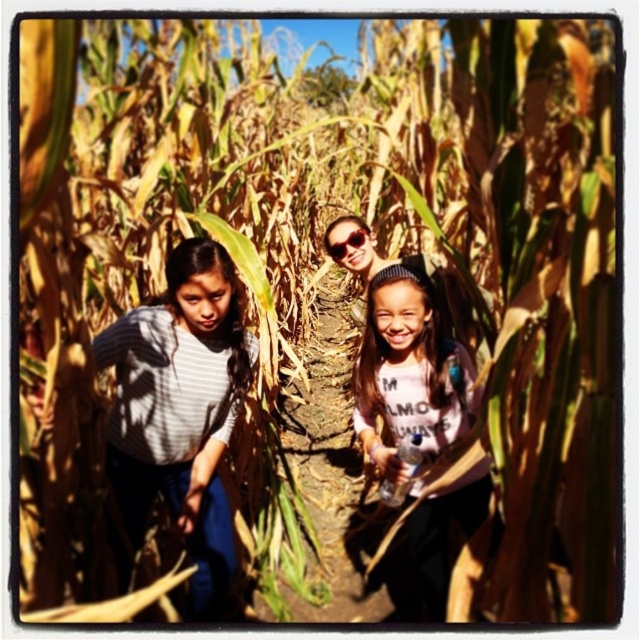
Who is positioned more to the left, white cotton shirt at center or sunglasses at center?

From the viewer's perspective, sunglasses at center appears more on the left side.

Which is in front, point (410, 394) or point (336, 244)?

Positioned in front is point (410, 394).

What do you see at coordinates (410, 372) in the screenshot? I see `white cotton shirt at center` at bounding box center [410, 372].

In order to click on white cotton shirt at center in this screenshot , I will do `click(410, 372)`.

Which is above, gray striped shirt at left or sunglasses at center?

sunglasses at center is above.

Is gray striped shirt at left bigger than sunglasses at center?

Yes, gray striped shirt at left is bigger than sunglasses at center.

Between point (176, 419) and point (356, 237), which one is positioned behind?

Positioned behind is point (356, 237).

You are a GUI agent. You are given a task and a screenshot of the screen. Output one action in this format:
    pyautogui.click(x=<x>, y=<y>)
    Task: Click on the gray striped shirt at left
    This screenshot has width=640, height=640.
    Given the screenshot: What is the action you would take?
    pyautogui.click(x=180, y=410)

Does gray striped shirt at left have a greater width compared to white cotton shirt at center?

Yes, gray striped shirt at left is wider than white cotton shirt at center.

Locate an element on the screen. gray striped shirt at left is located at coordinates (180, 410).